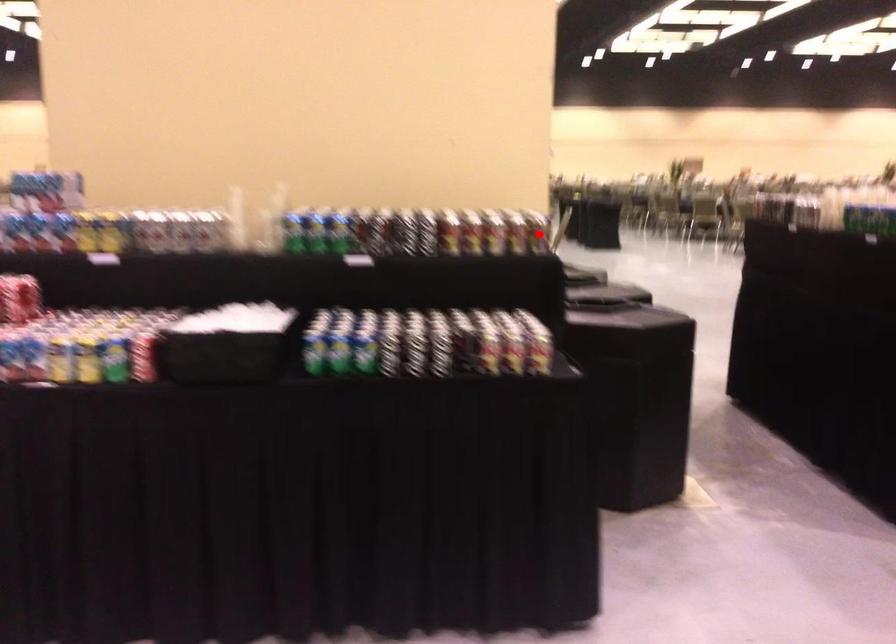
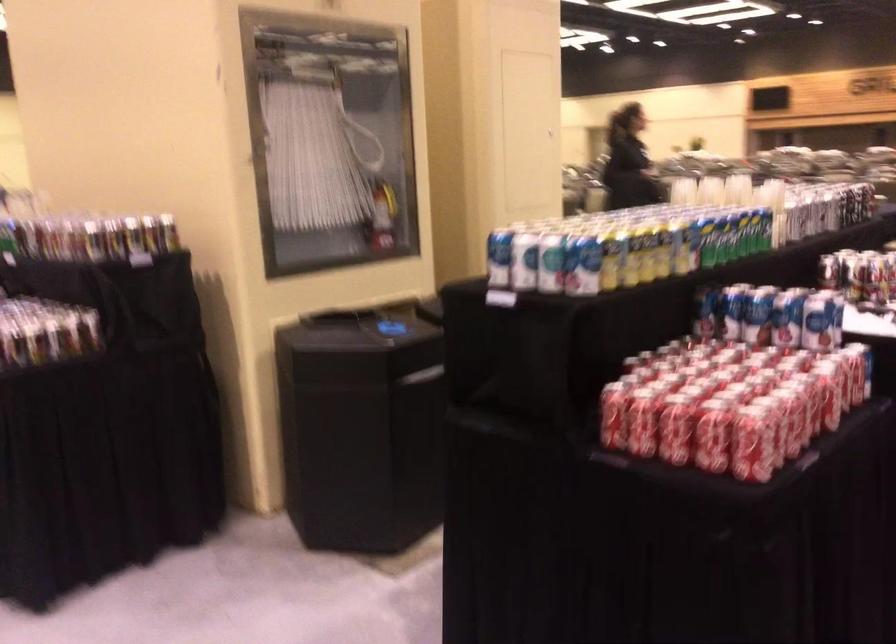
In the second image, find the point that corresponds to the highlighted location in the first image.

(131, 254)